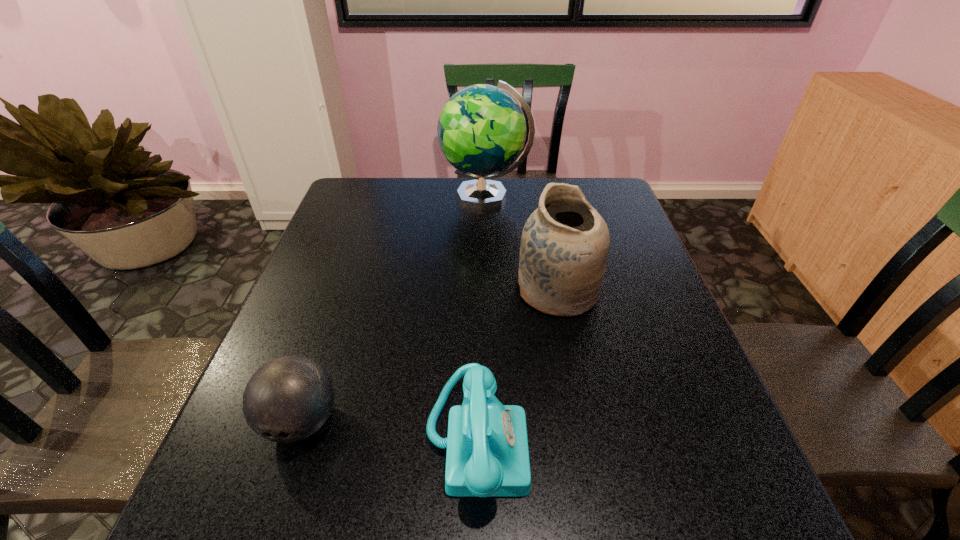
Locate an element on the screen. The height and width of the screenshot is (540, 960). blank region between the bowling ball and the second tallest object is located at coordinates (429, 356).

This screenshot has width=960, height=540. Find the location of `free space between the telephone and the bowling ball`. free space between the telephone and the bowling ball is located at coordinates (389, 431).

Find the location of a particular element. vacant area that lies between the telephone and the pottery is located at coordinates (517, 366).

Locate an element on the screen. This screenshot has height=540, width=960. vacant area that lies between the third shortest object and the bowling ball is located at coordinates (429, 356).

Where is `free spot between the bowling ball and the farthest object`? The width and height of the screenshot is (960, 540). free spot between the bowling ball and the farthest object is located at coordinates (394, 309).

Identify the location of vacant space that is in between the leftmost object and the third nearest object. The width and height of the screenshot is (960, 540). (429, 356).

The width and height of the screenshot is (960, 540). I want to click on free space between the telephone and the third shortest object, so click(x=517, y=366).

This screenshot has width=960, height=540. I want to click on vacant space that's between the telephone and the tallest object, so click(481, 319).

Where is `object that is the third closest one to the telephone`? This screenshot has height=540, width=960. object that is the third closest one to the telephone is located at coordinates (481, 130).

Find the location of a particular element. The image size is (960, 540). the third closest object to the third nearest object is located at coordinates (289, 398).